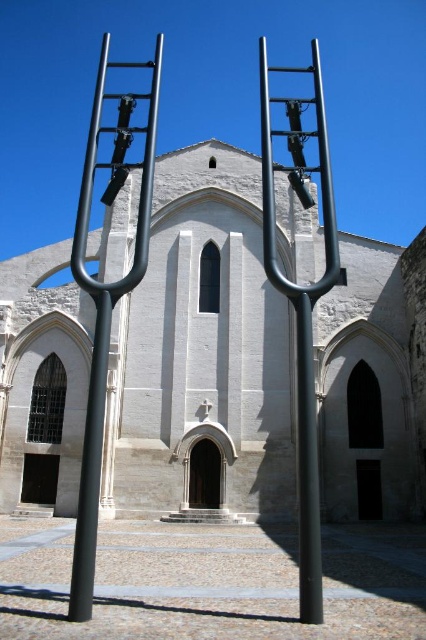
Question: Does polished metal ladder at center appear on the left side of black matte pole at center?

Choices:
 (A) no
 (B) yes

Answer: (B)

Question: Considering the real-world distances, which object is closest to the polished metal ladder at center?

Choices:
 (A) white stone church at center
 (B) black matte pole at center
 (C) metallic black ladder at center

Answer: (A)

Question: Observing the image, what is the correct spatial positioning of white stone church at center in reference to metallic black ladder at center?

Choices:
 (A) left
 (B) right

Answer: (A)

Question: Which point is closer to the camera?

Choices:
 (A) (112, 208)
 (B) (319, 156)

Answer: (B)

Question: Can you confirm if white stone church at center is positioned below black matte pole at center?

Choices:
 (A) no
 (B) yes

Answer: (A)

Question: Which of the following is the closest to the observer?

Choices:
 (A) polished metal ladder at center
 (B) black matte pole at center

Answer: (B)